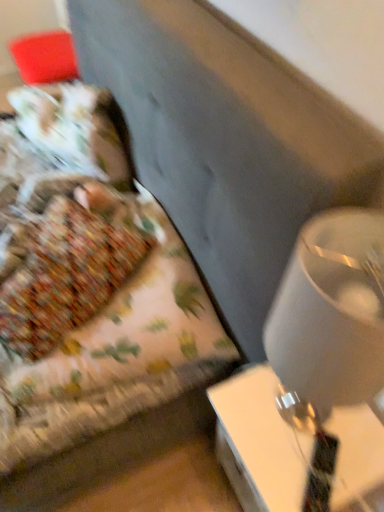
Question: Does white glossy lampshade at right have a larger size compared to floral fabric bed at left?

Choices:
 (A) yes
 (B) no

Answer: (B)

Question: Considering the relative sizes of white glossy lampshade at right and floral fabric bed at left in the image provided, is white glossy lampshade at right shorter than floral fabric bed at left?

Choices:
 (A) yes
 (B) no

Answer: (B)

Question: From the image's perspective, is white glossy lampshade at right on top of floral fabric bed at left?

Choices:
 (A) yes
 (B) no

Answer: (B)

Question: Is white glossy lampshade at right in front of floral fabric bed at left?

Choices:
 (A) yes
 (B) no

Answer: (A)

Question: Is white glossy lampshade at right wider than floral fabric bed at left?

Choices:
 (A) yes
 (B) no

Answer: (B)

Question: Considering the positions of floral fabric bed at left and white glossy lampshade at right in the image, is floral fabric bed at left wider or thinner than white glossy lampshade at right?

Choices:
 (A) thin
 (B) wide

Answer: (B)

Question: Relative to white glossy lampshade at right, is floral fabric bed at left in front or behind?

Choices:
 (A) behind
 (B) front

Answer: (A)

Question: Does point [x=13, y=252] appear closer or farther from the camera than point [x=380, y=227]?

Choices:
 (A) closer
 (B) farther

Answer: (B)

Question: From the image's perspective, relative to white glossy lampshade at right, is floral fabric bed at left above or below?

Choices:
 (A) below
 (B) above

Answer: (B)

Question: Which is correct: white glossy table at lower right is inside floral fabric bed at left, or outside of it?

Choices:
 (A) outside
 (B) inside

Answer: (A)

Question: From the image's perspective, is white glossy table at lower right positioned above or below floral fabric bed at left?

Choices:
 (A) below
 (B) above

Answer: (A)

Question: Is white glossy table at lower right wider or thinner than floral fabric bed at left?

Choices:
 (A) thin
 (B) wide

Answer: (A)

Question: From a real-world perspective, is white glossy table at lower right positioned above or below floral fabric bed at left?

Choices:
 (A) above
 (B) below

Answer: (B)

Question: Looking at their shapes, would you say white glossy lampshade at right is wider or thinner than white glossy table at lower right?

Choices:
 (A) wide
 (B) thin

Answer: (B)

Question: From a real-world perspective, is white glossy lampshade at right above or below white glossy table at lower right?

Choices:
 (A) below
 (B) above

Answer: (B)